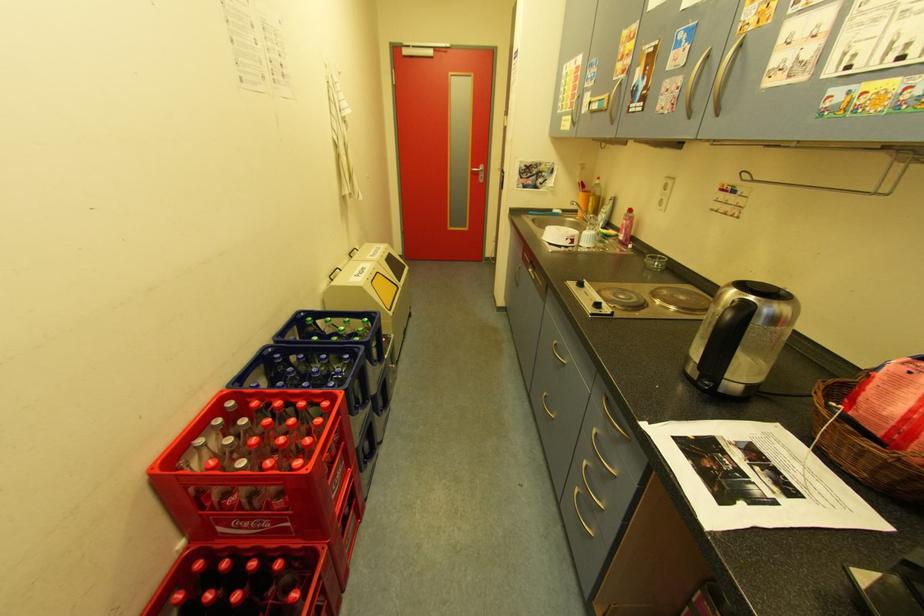
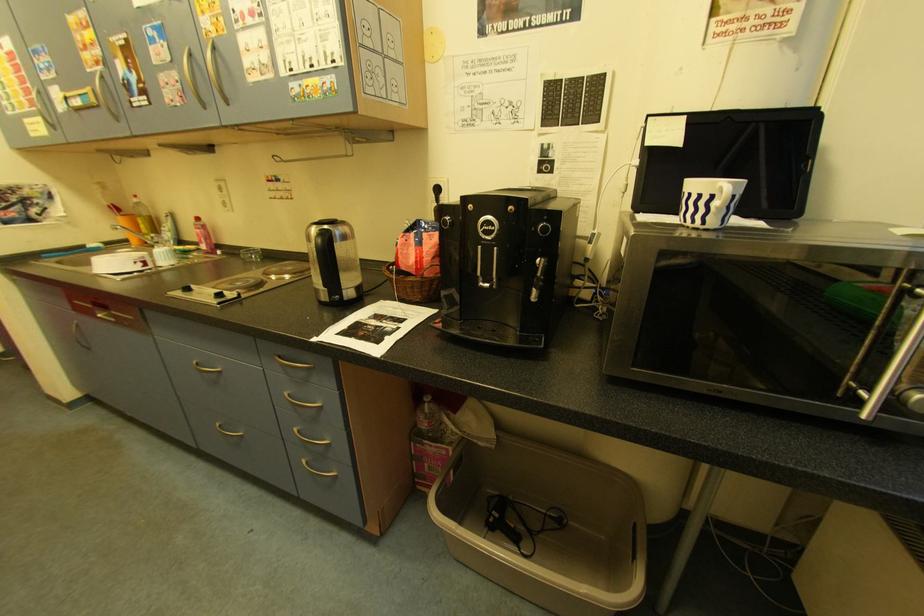
Question: The camera is either moving clockwise (left) or counter-clockwise (right) around the object. The first image is from the beginning of the video and the second image is from the end. Is the camera moving left or right when shooting the video?

Choices:
 (A) Left
 (B) Right

Answer: (A)